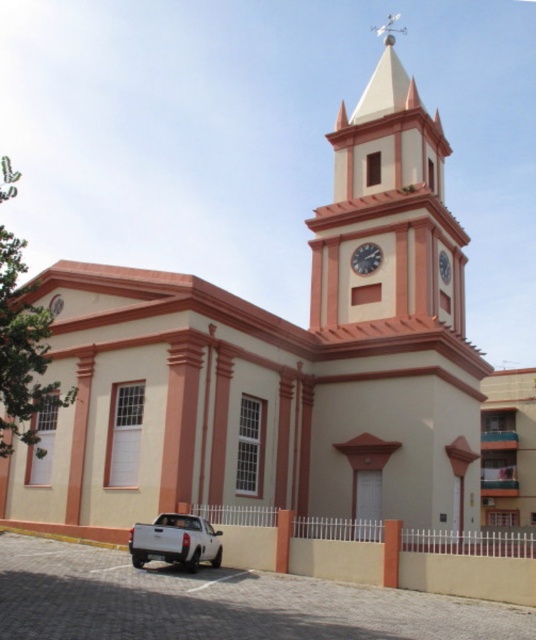
Question: Which object is closer to the camera taking this photo?

Choices:
 (A) white glossy clock at upper center
 (B) matte pink clock tower at upper center
 (C) matte brown clock at upper center

Answer: (B)

Question: Which object is the closest to the matte brown clock at upper center?

Choices:
 (A) matte pink clock tower at upper center
 (B) white glossy clock at upper center

Answer: (B)

Question: Which of the following is the farthest from the observer?

Choices:
 (A) (448, 308)
 (B) (448, 264)

Answer: (B)

Question: Is white glossy clock at upper center wider than matte brown clock at upper center?

Choices:
 (A) yes
 (B) no

Answer: (A)

Question: Is matte pink clock tower at upper center below white matte pickup truck at lower left?

Choices:
 (A) yes
 (B) no

Answer: (B)

Question: Is white matte pickup truck at lower left to the right of white glossy clock at upper center from the viewer's perspective?

Choices:
 (A) yes
 (B) no

Answer: (B)